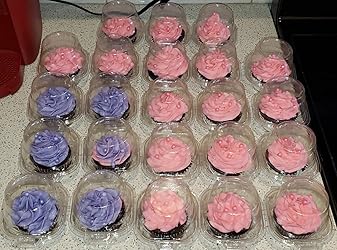
The image size is (337, 250). What are the coordinates of `black fridge` in the screenshot? It's located at click(x=314, y=48).